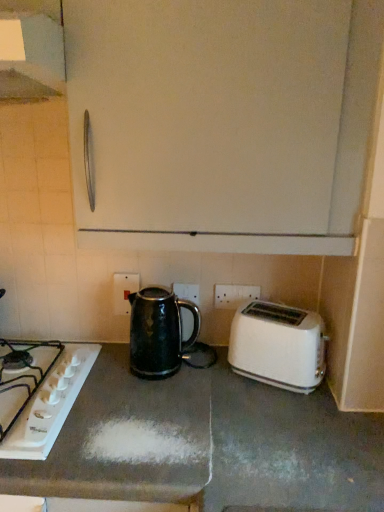
Locate an element on the screen. vacant space in front of black glossy kettle at center is located at coordinates (151, 404).